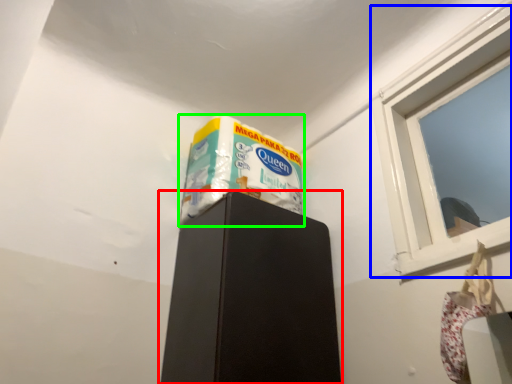
Question: Considering the real-world distances, which object is closest to furniture (highlighted by a red box)? window (highlighted by a blue box) or wrapping paper (highlighted by a green box).

Choices:
 (A) window
 (B) wrapping paper

Answer: (B)